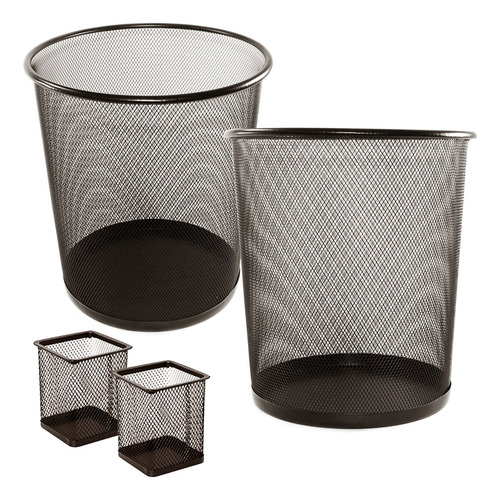
The height and width of the screenshot is (500, 500). Identify the location of corner. (95, 332), (43, 346), (79, 358), (128, 348), (172, 361), (121, 371), (156, 392), (211, 378).